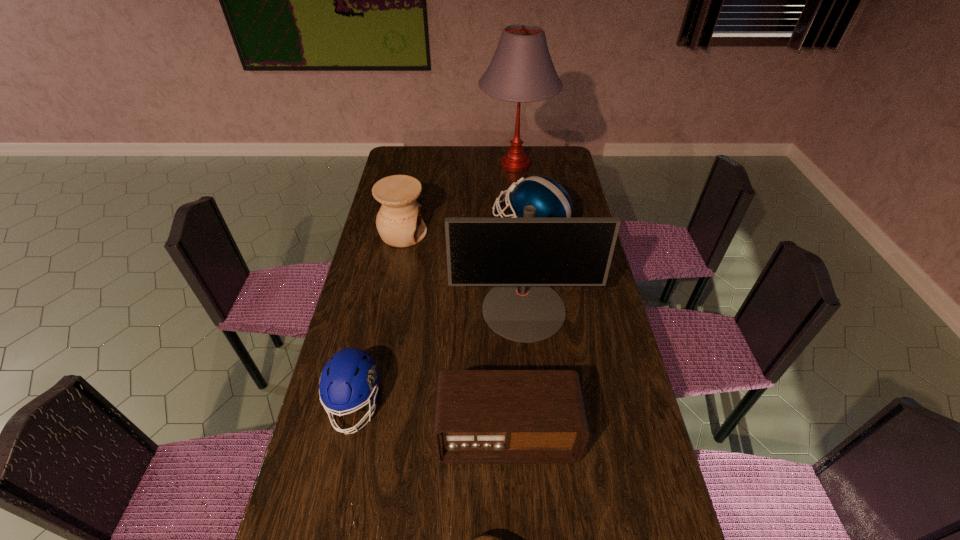
Where is `free space located on the front-facing side of the farthest object`? This screenshot has height=540, width=960. free space located on the front-facing side of the farthest object is located at coordinates (441, 165).

Image resolution: width=960 pixels, height=540 pixels. Identify the location of vacant space located on the front-facing side of the farthest object. 453,165.

Where is `vacant space located 0.210m on the front-facing side of the farthest object`? vacant space located 0.210m on the front-facing side of the farthest object is located at coordinates (434, 165).

Identify the location of vacant position located 0.080m on the screen of the fourth nearest object. This screenshot has width=960, height=540. (529, 366).

Find the location of `blank area located 0.290m at the front of the taller football helmet with the faceguard`. blank area located 0.290m at the front of the taller football helmet with the faceguard is located at coordinates (420, 226).

Image resolution: width=960 pixels, height=540 pixels. Identify the location of vacant space located 0.110m at the front of the taller football helmet with the faceguard. (465, 226).

Identify the location of vacant space situated at the front of the taller football helmet with the faceguard. (472, 226).

Locate an element on the screen. Image resolution: width=960 pixels, height=540 pixels. vacant area situated 0.130m at the open side of the pottery is located at coordinates (461, 233).

Identify the location of vacant space located on the front-facing side of the radio receiver. (510, 515).

The image size is (960, 540). Find the location of `vacant area located 0.130m on the front-facing side of the nearer football helmet`. vacant area located 0.130m on the front-facing side of the nearer football helmet is located at coordinates (336, 494).